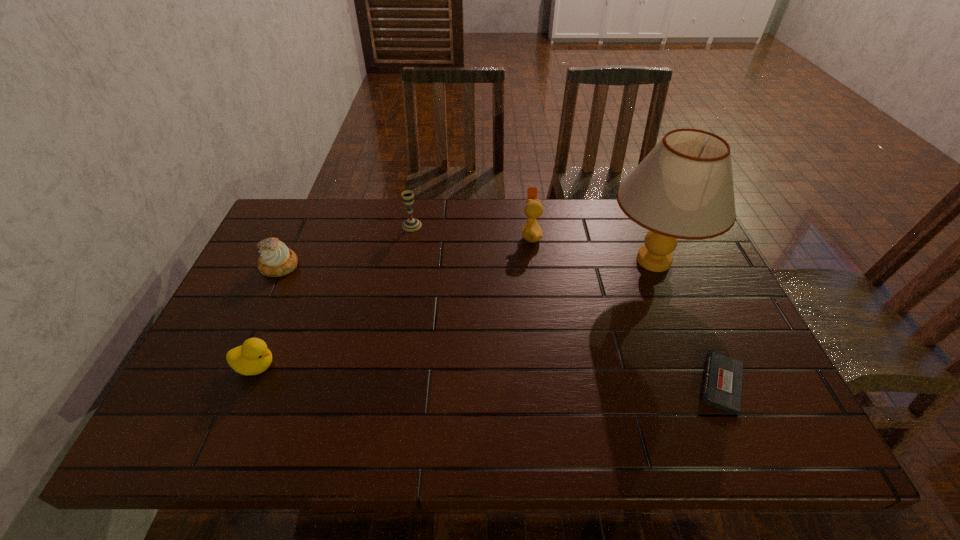
Locate an element on the screen. The image size is (960, 540). object that is the closest to the tallest object is located at coordinates (531, 232).

Locate an element on the screen. The height and width of the screenshot is (540, 960). free location that satisfies the following two spatial constraints: 1. on the front side of the tallest object; 2. on the right side of the chalice is located at coordinates (405, 261).

Locate an element on the screen. free space that satisfies the following two spatial constraints: 1. on the back side of the pastry; 2. on the left side of the chalice is located at coordinates (299, 225).

Where is `vacant space that satisfies the following two spatial constraints: 1. on the beak of the videotape; 2. on the left side of the taller duck`? Image resolution: width=960 pixels, height=540 pixels. vacant space that satisfies the following two spatial constraints: 1. on the beak of the videotape; 2. on the left side of the taller duck is located at coordinates (550, 383).

This screenshot has height=540, width=960. I want to click on vacant space that satisfies the following two spatial constraints: 1. on the front-facing side of the left duck; 2. on the right side of the shortest object, so 249,383.

The image size is (960, 540). In order to click on vacant space that satisfies the following two spatial constraints: 1. on the beak of the shortest object; 2. on the left side of the right duck in this screenshot , I will do `click(550, 383)`.

I want to click on vacant space that satisfies the following two spatial constraints: 1. on the front-facing side of the left duck; 2. on the right side of the shortest object, so click(x=249, y=383).

Where is `free space that satisfies the following two spatial constraints: 1. on the front-facing side of the shorter duck; 2. on the left side of the shortest object`? This screenshot has width=960, height=540. free space that satisfies the following two spatial constraints: 1. on the front-facing side of the shorter duck; 2. on the left side of the shortest object is located at coordinates (249, 383).